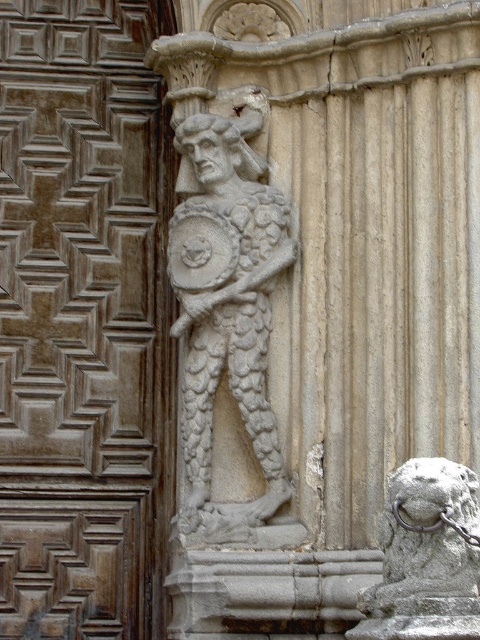
You are an architect examining the facade. You need to determine which object is taller between the carved stone warrior at center and the gray stone lion at lower right. Which one is taller?

The carved stone warrior at center is taller than the gray stone lion at lower right according to the description.

Looking at this image, you are a painter standing in front of the architectural facade. You need to paint both the brown wood door at center and the gray stone lion at lower right. Which object will require you to lift your brush higher to reach its top?

The brown wood door at center is much taller than the gray stone lion at lower right, so you will need to lift your brush higher to reach the top of the brown wood door at center.

What are the coordinates of the brown wood door at center in the image?

The brown wood door at center is located at coordinates point (83, 320).